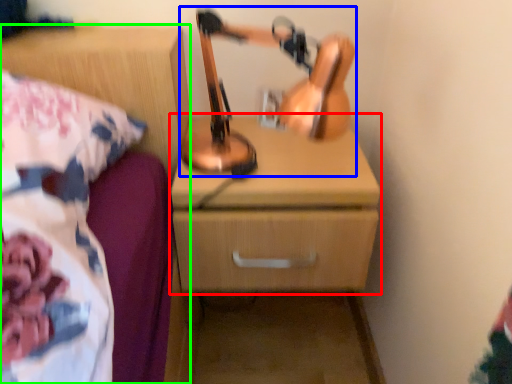
Question: Which object is the farthest from chest of drawers (highlighted by a red box)? Choose among these: table lamp (highlighted by a blue box) or nightstand (highlighted by a green box).

Choices:
 (A) table lamp
 (B) nightstand

Answer: (B)